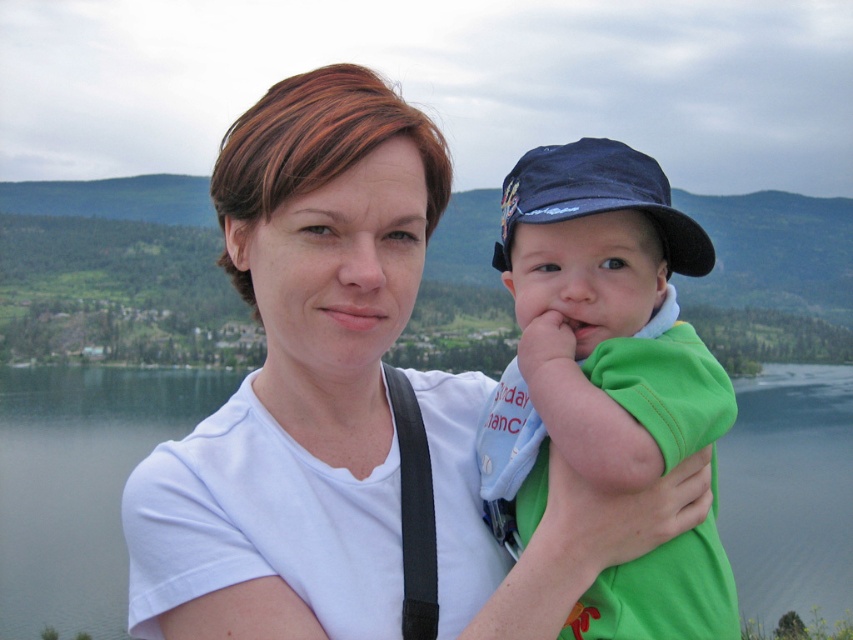
Question: Where is white cotton shirt at center located in relation to transparent water at center in the image?

Choices:
 (A) below
 (B) above

Answer: (B)

Question: Is transparent water at center smaller than dark blue fabric baseball cap at center?

Choices:
 (A) no
 (B) yes

Answer: (A)

Question: Estimate the real-world distances between objects in this image. Which object is farther from the green cotton shirt at center?

Choices:
 (A) transparent water at center
 (B) white cotton shirt at center

Answer: (A)

Question: Which point is closer to the camera?

Choices:
 (A) (577, 216)
 (B) (672, 246)

Answer: (A)

Question: Estimate the real-world distances between objects in this image. Which object is closer to the dark blue fabric baseball cap at center?

Choices:
 (A) green cotton shirt at center
 (B) transparent water at center

Answer: (A)

Question: Is green cotton shirt at center positioned behind transparent water at center?

Choices:
 (A) yes
 (B) no

Answer: (B)